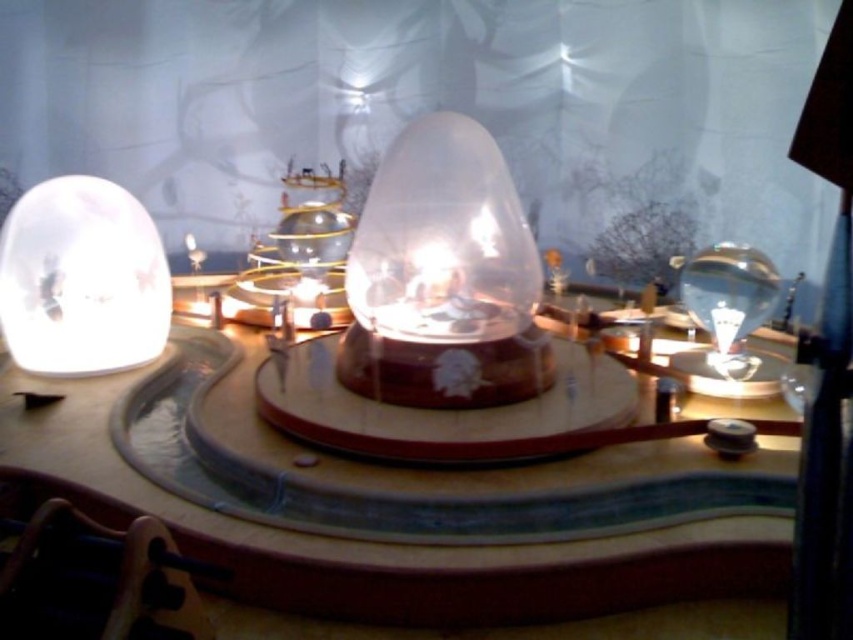
Does point (462, 561) lie in front of point (454, 248)?

Yes, point (462, 561) is closer to viewer.

Which is in front, point (622, 445) or point (440, 275)?

Positioned in front is point (622, 445).

Identify the location of translucent glass table at center. Image resolution: width=853 pixels, height=640 pixels. (392, 502).

Who is shorter, translucent glass table at center or translucent glass globe at left?

Standing shorter between the two is translucent glass table at center.

Does point (306, 561) come closer to viewer compared to point (27, 291)?

Yes, it is.

Does point (218, 570) come behind point (71, 344)?

That is False.

Where is `translucent glass table at center`? Image resolution: width=853 pixels, height=640 pixels. translucent glass table at center is located at coordinates (392, 502).

Does transparent glass dome at center have a larger size compared to translucent glass globe at left?

Correct, transparent glass dome at center is larger in size than translucent glass globe at left.

Which is below, transparent glass dome at center or translucent glass globe at left?

translucent glass globe at left is lower down.

The image size is (853, 640). What do you see at coordinates (444, 276) in the screenshot?
I see `transparent glass dome at center` at bounding box center [444, 276].

Identify the location of transparent glass dome at center. (444, 276).